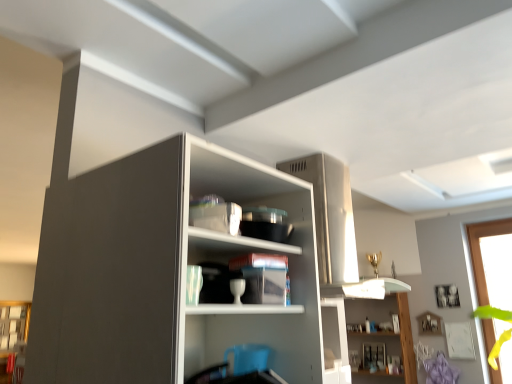
What do you see at coordinates (480, 251) in the screenshot? I see `transparent glass window at right` at bounding box center [480, 251].

Find the location of a particular element. matte cardboard box at center, which ranks as the 1th shelf in front-to-back order is located at coordinates (242, 309).

Where is `transparent glass window at right`? This screenshot has width=512, height=384. transparent glass window at right is located at coordinates (480, 251).

Consider the image. Considering the sizes of objects white glossy shelf at upper center, acting as the second shelf starting from the front, and transparent glass window at right in the image provided, who is taller, white glossy shelf at upper center, acting as the second shelf starting from the front, or transparent glass window at right?

With more height is transparent glass window at right.

Identify the location of window that is in front of the white glossy shelf at upper center, the 2th shelf from the left. The image size is (512, 384). (480, 251).

Is point (361, 316) closer or farther from the camera than point (482, 280)?

Point (361, 316).

Is white glossy shelf at upper center, arranged as the second shelf when viewed from the top, next to transparent glass window at right?

No, white glossy shelf at upper center, arranged as the second shelf when viewed from the top, is not making contact with transparent glass window at right.

Which is in front, point (188, 305) or point (494, 224)?

The point (188, 305) is in front.

From a real-world perspective, is matte cardboard box at center, the 2th shelf positioned from the back, on transparent glass window at right?

Yes, from a real-world perspective, matte cardboard box at center, the 2th shelf positioned from the back, is above transparent glass window at right.

Is the position of matte cardboard box at center, the 2th shelf positioned from the back, less distant than that of transparent glass window at right?

Yes, matte cardboard box at center, the 2th shelf positioned from the back, is closer to the viewer.

Would you say matte cardboard box at center, marked as the 1th shelf in a left-to-right arrangement, is to the left or to the right of transparent glass window at right in the picture?

matte cardboard box at center, marked as the 1th shelf in a left-to-right arrangement, is positioned on transparent glass window at right's left side.

Identify the location of shelf below the matte cardboard box at center, marked as the 1th shelf in a left-to-right arrangement (from a real-world perspective). The width and height of the screenshot is (512, 384). (372, 333).

Considering the sizes of white glossy shelf at upper center, arranged as the second shelf when viewed from the top, and matte cardboard box at center, the 2th shelf positioned from the bottom, in the image, is white glossy shelf at upper center, arranged as the second shelf when viewed from the top, wider or thinner than matte cardboard box at center, the 2th shelf positioned from the bottom,?

Considering their sizes, white glossy shelf at upper center, arranged as the second shelf when viewed from the top, looks slimmer than matte cardboard box at center, the 2th shelf positioned from the bottom.

Between point (376, 335) and point (233, 312), which one is positioned behind?

The point (376, 335) is more distant.

From the image's perspective, who appears lower, white glossy shelf at upper center, acting as the second shelf starting from the front, or matte cardboard box at center, which is the first shelf from top to bottom?

white glossy shelf at upper center, acting as the second shelf starting from the front, appears lower in the image.

From a real-world perspective, does transparent glass window at right stand above matte cardboard box at center, which is the first shelf from top to bottom?

Incorrect, from a real-world perspective, transparent glass window at right is lower than matte cardboard box at center, which is the first shelf from top to bottom.

Based on the photo, from the image's perspective, is transparent glass window at right positioned above or below matte cardboard box at center, which ranks as the 1th shelf in front-to-back order?

transparent glass window at right is below matte cardboard box at center, which ranks as the 1th shelf in front-to-back order.

The height and width of the screenshot is (384, 512). I want to click on window below the matte cardboard box at center, marked as the 1th shelf in a left-to-right arrangement (from the image's perspective), so click(480, 251).

Is transparent glass window at right turned away from matte cardboard box at center, which is the first shelf from top to bottom?

No, transparent glass window at right is not facing away from matte cardboard box at center, which is the first shelf from top to bottom.

Considering the positions of objects transparent glass window at right and white glossy shelf at upper center, which ranks as the 1th shelf in right-to-left order, in the image provided, who is in front, transparent glass window at right or white glossy shelf at upper center, which ranks as the 1th shelf in right-to-left order,?

Positioned in front is transparent glass window at right.

Which of these two, transparent glass window at right or white glossy shelf at upper center, the 2th shelf from the left, stands taller?

transparent glass window at right.

Is transparent glass window at right not near white glossy shelf at upper center, placed as the 1th shelf when sorted from back to front?

Actually, transparent glass window at right and white glossy shelf at upper center, placed as the 1th shelf when sorted from back to front, are a little close together.

From a real-world perspective, between transparent glass window at right and white glossy shelf at upper center, the 2th shelf from the left, who is vertically higher?

transparent glass window at right is physically above.

Between point (203, 314) and point (386, 320), which one is positioned behind?

The point (386, 320) is more distant.

What's the angular difference between matte cardboard box at center, the 2th shelf positioned from the back, and white glossy shelf at upper center, the 2th shelf from the left,'s facing directions?

There is a 90.4-degree angle between the facing directions of matte cardboard box at center, the 2th shelf positioned from the back, and white glossy shelf at upper center, the 2th shelf from the left.

Is the surface of matte cardboard box at center, marked as the 1th shelf in a left-to-right arrangement, in direct contact with white glossy shelf at upper center, arranged as the second shelf when viewed from the top?

No, matte cardboard box at center, marked as the 1th shelf in a left-to-right arrangement, is not in contact with white glossy shelf at upper center, arranged as the second shelf when viewed from the top.

Is matte cardboard box at center, which ranks as the 1th shelf in front-to-back order, positioned behind white glossy shelf at upper center, which ranks as the 1th shelf in right-to-left order?

No, it is in front of white glossy shelf at upper center, which ranks as the 1th shelf in right-to-left order.

Locate an element on the screen. shelf below the transparent glass window at right (from a real-world perspective) is located at coordinates (372, 333).

This screenshot has width=512, height=384. Identify the location of window that appears below the matte cardboard box at center, the 2th shelf positioned from the bottom (from the image's perspective). (480, 251).

When comparing their distances from transparent glass window at right, does white glossy shelf at upper center, the 2th shelf from the left, or matte cardboard box at center, the 2th shelf positioned from the right, seem closer?

The object closer to transparent glass window at right is white glossy shelf at upper center, the 2th shelf from the left.

Looking at this image, from the image, which object appears to be nearer to white glossy shelf at upper center, placed as the 1th shelf when sorted from back to front, matte cardboard box at center, the 2th shelf positioned from the bottom, or transparent glass window at right?

transparent glass window at right.

From the image, which object appears to be farther from transparent glass window at right, matte cardboard box at center, marked as the 1th shelf in a left-to-right arrangement, or white glossy shelf at upper center, acting as the second shelf starting from the front?

matte cardboard box at center, marked as the 1th shelf in a left-to-right arrangement, lies further to transparent glass window at right than the other object.

Considering their positions, is white glossy shelf at upper center, the 1th shelf ordered from the bottom, positioned further to matte cardboard box at center, the 2th shelf positioned from the bottom, than transparent glass window at right?

Among the two, transparent glass window at right is located further to matte cardboard box at center, the 2th shelf positioned from the bottom.

Which object lies further to the anchor point white glossy shelf at upper center, which ranks as the 1th shelf in right-to-left order, transparent glass window at right or matte cardboard box at center, which is the first shelf from top to bottom?

Based on the image, matte cardboard box at center, which is the first shelf from top to bottom, appears to be further to white glossy shelf at upper center, which ranks as the 1th shelf in right-to-left order.

From the image, which object appears to be nearer to matte cardboard box at center, marked as the 1th shelf in a left-to-right arrangement, transparent glass window at right or white glossy shelf at upper center, placed as the 1th shelf when sorted from back to front?

white glossy shelf at upper center, placed as the 1th shelf when sorted from back to front, is closer to matte cardboard box at center, marked as the 1th shelf in a left-to-right arrangement.

Find the location of a particular element. The height and width of the screenshot is (384, 512). window between matte cardboard box at center, the 2th shelf positioned from the right, and white glossy shelf at upper center, arranged as the second shelf when viewed from the top, along the z-axis is located at coordinates (480, 251).